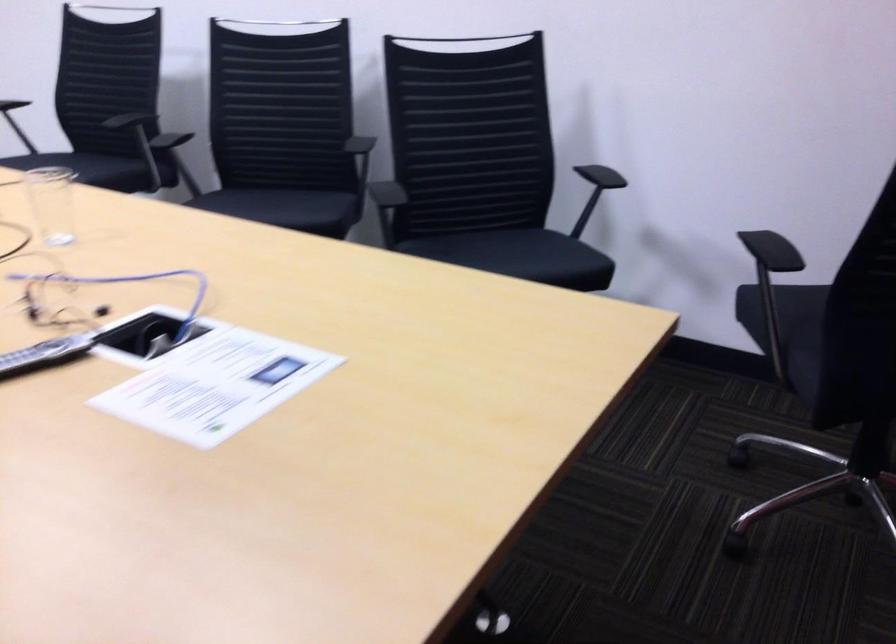
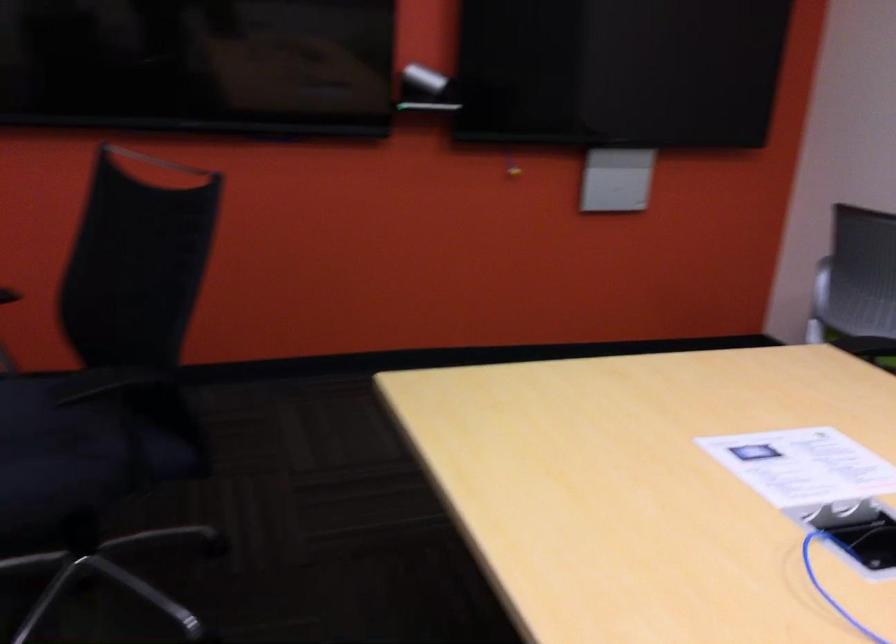
Locate, in the second image, the point that corresponds to [204,389] in the first image.

(803, 466)